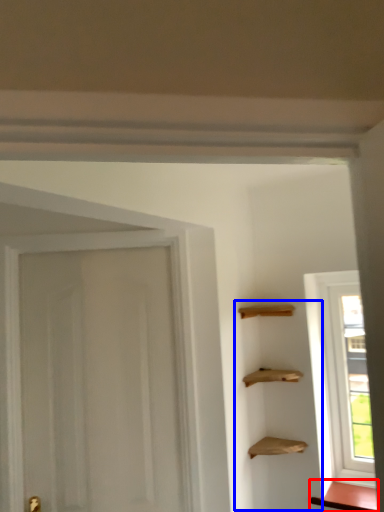
Question: Which object appears farthest to the camera in this image, cabinetry (highlighted by a red box) or cabinetry (highlighted by a blue box)?

Choices:
 (A) cabinetry
 (B) cabinetry

Answer: (A)